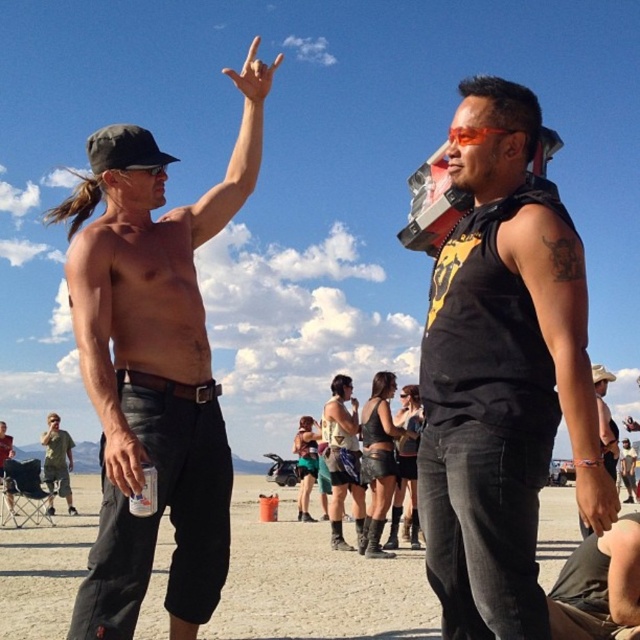
Question: Is black matte tank top at center bigger than brushed metal can at lower left?

Choices:
 (A) no
 (B) yes

Answer: (A)

Question: Which object is closer to the camera taking this photo?

Choices:
 (A) shiny metallic can at left
 (B) matte black tank top at center
 (C) matte skin hand at upper center
 (D) matte black hand at lower right

Answer: (B)

Question: Where is shiny metallic can at left located in relation to denim shorts at lower right in the image?

Choices:
 (A) above
 (B) below

Answer: (A)

Question: Which object appears farthest from the camera in this image?

Choices:
 (A) shiny metallic can at left
 (B) denim shorts at lower right
 (C) matte skin hand at upper center
 (D) matte black hand at lower right

Answer: (C)

Question: Which point is farther from the camera taking this photo?

Choices:
 (A) (147, 456)
 (B) (609, 433)

Answer: (B)

Question: Can you confirm if shiny metallic can at left is positioned above brushed metal can at lower left?

Choices:
 (A) yes
 (B) no

Answer: (A)